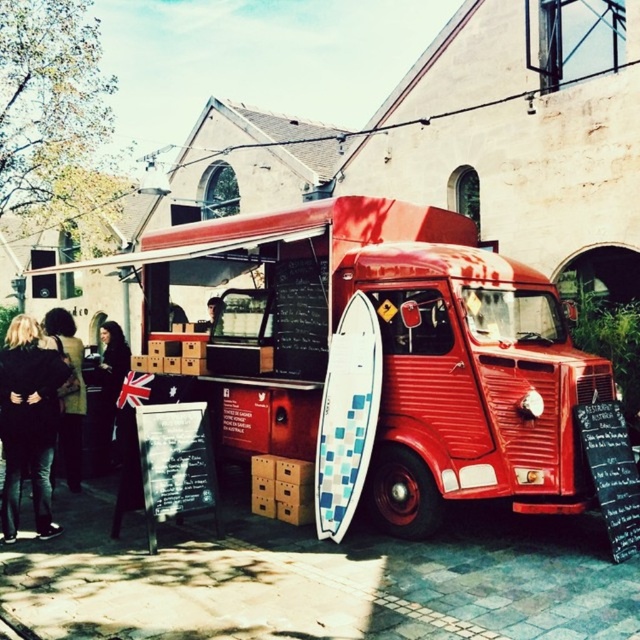
You are a photographer standing in front of the vibrant red vintage food truck. You notice two features in the scene, the dark brown hair at left and the smooth skin face at center. Which of these two features is closer to you?

The dark brown hair at left is closer to you because it is further to the viewer than the smooth skin face at center.

You are a delivery person standing in front of the red vintage food truck. You need to place a large box that is 2 meters long. The white checkered surfboard at center is in your way. Can you move the box past the surfboard without tilting it?

The white checkered surfboard at center is 6.15 meters from the viewer, so the distance is sufficient to move the 2 meters long box past it without tilting, as there is enough space between the surfboard and the delivery person.

You are a customer standing in front of the food truck and want to pick up your order. You notice the black leather jacket at lower left and the white checkered surfboard at center. Which object is closer to you?

The white checkered surfboard at center is closer to you because the black leather jacket at lower left is behind it.